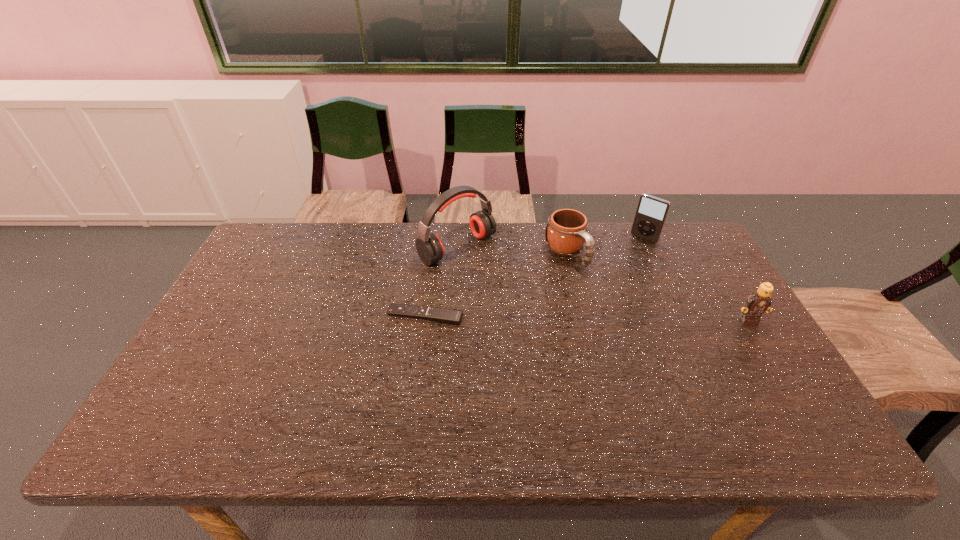
The image size is (960, 540). I want to click on vacant area that lies between the Lego and the third object from left to right, so click(657, 286).

Where is `free space between the Lego and the tallest object`? This screenshot has width=960, height=540. free space between the Lego and the tallest object is located at coordinates (603, 284).

You are a GUI agent. You are given a task and a screenshot of the screen. Output one action in this format:
    pyautogui.click(x=<x>, y=<y>)
    Task: Click on the free spot between the rightmost object and the third object from left to right
    
    Given the screenshot: What is the action you would take?
    pyautogui.click(x=657, y=286)

The height and width of the screenshot is (540, 960). I want to click on vacant area that lies between the shortest object and the mug, so click(495, 285).

The width and height of the screenshot is (960, 540). What are the coordinates of `free spot between the earphone and the remote control` in the screenshot? It's located at (441, 282).

At what (x,y) coordinates should I click in order to perform the action: click on free space between the tallest object and the third object from right to left. Please return your answer as a coordinate pair (x, y). Looking at the image, I should click on (512, 251).

The image size is (960, 540). I want to click on blank region between the rightmost object and the mug, so click(657, 286).

Where is `vacant space in between the third object from left to right and the rightmost object`? vacant space in between the third object from left to right and the rightmost object is located at coordinates (657, 286).

Identify the location of free space between the mug and the remote control. (495, 285).

Locate an element on the screen. The image size is (960, 540). object that stands as the third closest to the mug is located at coordinates (448, 316).